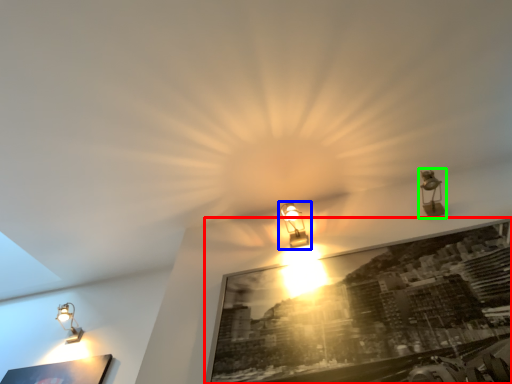
Question: Which object is the farthest from picture frame (highlighted by a red box)? Choose among these: lamp (highlighted by a blue box) or lamp (highlighted by a green box).

Choices:
 (A) lamp
 (B) lamp

Answer: (B)